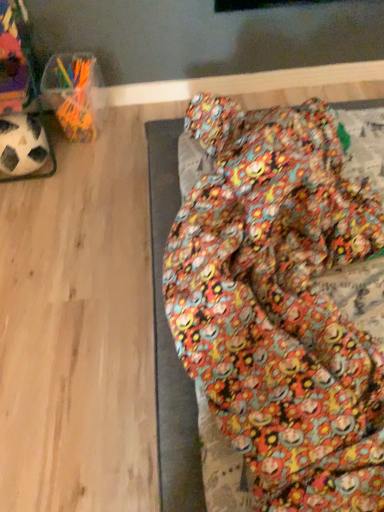
Measure the distance between floral fabric bean bag at lower right and camera.

They are 59.37 centimeters apart.

Find the location of a particular element. floral fabric bean bag at lower right is located at coordinates (280, 304).

What do you see at coordinates (280, 304) in the screenshot? The image size is (384, 512). I see `floral fabric bean bag at lower right` at bounding box center [280, 304].

What is the approximate height of floral fabric bean bag at lower right?

The height of floral fabric bean bag at lower right is 2.43 inches.

Measure the distance between black matte soccer ball at left and camera.

black matte soccer ball at left and camera are 4.61 feet apart.

Where is `black matte soccer ball at left`? black matte soccer ball at left is located at coordinates (22, 145).

What is the approximate width of black matte soccer ball at left?

black matte soccer ball at left is 8.89 inches wide.

This screenshot has height=512, width=384. Describe the element at coordinates (22, 145) in the screenshot. I see `black matte soccer ball at left` at that location.

Locate an element on the screen. floral fabric bean bag at lower right is located at coordinates (280, 304).

Visually, is black matte soccer ball at left positioned to the left or to the right of floral fabric bean bag at lower right?

Clearly, black matte soccer ball at left is on the left of floral fabric bean bag at lower right in the image.

Which object is more forward, black matte soccer ball at left or floral fabric bean bag at lower right?

Positioned in front is floral fabric bean bag at lower right.

Between point (19, 115) and point (268, 143), which one is positioned in front?

Point (268, 143)

From the image's perspective, which one is positioned lower, black matte soccer ball at left or floral fabric bean bag at lower right?

floral fabric bean bag at lower right is shown below in the image.

From a real-world perspective, is black matte soccer ball at left physically above floral fabric bean bag at lower right?

Yes, from a real-world perspective, black matte soccer ball at left is over floral fabric bean bag at lower right

Does black matte soccer ball at left have a lesser width compared to floral fabric bean bag at lower right?

Indeed, black matte soccer ball at left has a lesser width compared to floral fabric bean bag at lower right.

From the picture: Considering the relative sizes of black matte soccer ball at left and floral fabric bean bag at lower right in the image provided, is black matte soccer ball at left shorter than floral fabric bean bag at lower right?

No.

Looking at the image, does black matte soccer ball at left seem bigger or smaller compared to floral fabric bean bag at lower right?

Considering their sizes, black matte soccer ball at left takes up less space than floral fabric bean bag at lower right.

Would you say floral fabric bean bag at lower right is part of black matte soccer ball at left's contents?

No.

Is black matte soccer ball at left far from floral fabric bean bag at lower right?

black matte soccer ball at left is near floral fabric bean bag at lower right, not far away.

Is black matte soccer ball at left facing away from floral fabric bean bag at lower right?

No, black matte soccer ball at left is not facing the opposite direction of floral fabric bean bag at lower right.

How different are the orientations of black matte soccer ball at left and floral fabric bean bag at lower right in degrees?

There is a 178-degree angle between the facing directions of black matte soccer ball at left and floral fabric bean bag at lower right.

Measure the distance from black matte soccer ball at left to floral fabric bean bag at lower right.

The distance of black matte soccer ball at left from floral fabric bean bag at lower right is 37.46 inches.

This screenshot has width=384, height=512. In order to click on bean bag chair in front of the black matte soccer ball at left in this screenshot , I will do `click(280, 304)`.

Considering the positions of objects floral fabric bean bag at lower right and black matte soccer ball at left in the image provided, who is more to the left, floral fabric bean bag at lower right or black matte soccer ball at left?

From the viewer's perspective, black matte soccer ball at left appears more on the left side.

Considering the positions of objects floral fabric bean bag at lower right and black matte soccer ball at left in the image provided, who is behind, floral fabric bean bag at lower right or black matte soccer ball at left?

black matte soccer ball at left is further away from the camera.

Which is farther from the camera, (268, 193) or (30, 116)?

The point (30, 116) is more distant.

From the image's perspective, would you say floral fabric bean bag at lower right is shown under black matte soccer ball at left?

Indeed, from the image's perspective, floral fabric bean bag at lower right is shown beneath black matte soccer ball at left.

From a real-world perspective, which object stands above the other?

In real-world perspective, black matte soccer ball at left is above.

From the picture: Considering the relative sizes of floral fabric bean bag at lower right and black matte soccer ball at left in the image provided, is floral fabric bean bag at lower right thinner than black matte soccer ball at left?

Incorrect, the width of floral fabric bean bag at lower right is not less than that of black matte soccer ball at left.

Which of these two, floral fabric bean bag at lower right or black matte soccer ball at left, stands taller?

black matte soccer ball at left is taller.

Considering the relative sizes of floral fabric bean bag at lower right and black matte soccer ball at left in the image provided, is floral fabric bean bag at lower right smaller than black matte soccer ball at left?

No.

In the scene shown: Is floral fabric bean bag at lower right situated inside black matte soccer ball at left or outside?

floral fabric bean bag at lower right is not inside black matte soccer ball at left, it's outside.

Are floral fabric bean bag at lower right and black matte soccer ball at left beside each other?

floral fabric bean bag at lower right and black matte soccer ball at left are not in contact.

Does floral fabric bean bag at lower right turn towards black matte soccer ball at left?

No, floral fabric bean bag at lower right is not turned towards black matte soccer ball at left.

Consider the image. Can you tell me how much floral fabric bean bag at lower right and black matte soccer ball at left differ in facing direction?

The facing directions of floral fabric bean bag at lower right and black matte soccer ball at left are 178 degrees apart.

Identify the location of football on the left of floral fabric bean bag at lower right. (22, 145).

This screenshot has width=384, height=512. What are the coordinates of `football above the floral fabric bean bag at lower right (from a real-world perspective)` in the screenshot? It's located at (22, 145).

Find the location of a particular element. This screenshot has width=384, height=512. football located on the left of floral fabric bean bag at lower right is located at coordinates (22, 145).